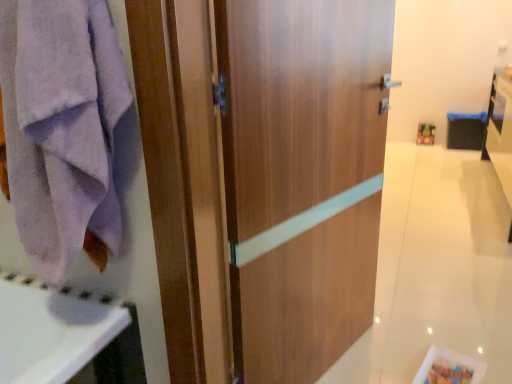
Identify the location of white glossy vanity at right. This screenshot has height=384, width=512. (500, 129).

Locate an element on the screen. The image size is (512, 384). wooden door at center is located at coordinates (266, 180).

The height and width of the screenshot is (384, 512). Identify the location of lavender cotton towel at left. (61, 125).

Find the location of a particular element. white glossy vanity at right is located at coordinates (500, 129).

Considering the sizes of white glossy vanity at right and wooden door at center in the image, is white glossy vanity at right wider or thinner than wooden door at center?

Clearly, white glossy vanity at right has more width compared to wooden door at center.

Is white glossy vanity at right looking in the opposite direction of wooden door at center?

white glossy vanity at right is not turned away from wooden door at center.

How distant is white glossy vanity at right from wooden door at center?

white glossy vanity at right is 9.16 feet from wooden door at center.

Who is bigger, white glossy vanity at right or wooden door at center?

white glossy vanity at right is bigger.

Is lavender cotton towel at left facing away from wooden door at center?

No, lavender cotton towel at left is not facing the opposite direction of wooden door at center.

How different are the orientations of lavender cotton towel at left and wooden door at center in degrees?

The angular difference between lavender cotton towel at left and wooden door at center is 0.000144 degrees.

In terms of width, does lavender cotton towel at left look wider or thinner when compared to wooden door at center?

Considering their sizes, lavender cotton towel at left looks broader than wooden door at center.

From the image's perspective, which object appears higher, lavender cotton towel at left or wooden door at center?

lavender cotton towel at left appears higher in the image.

Are wooden door at center and white glossy vanity at right making contact?

They are not placed beside each other.

Is the depth of wooden door at center less than that of white glossy vanity at right?

Yes.

Who is bigger, wooden door at center or white glossy vanity at right?

white glossy vanity at right.

Does point (325, 118) come behind point (508, 183)?

That is False.

From the image's perspective, does white glossy vanity at right appear lower than lavender cotton towel at left?

Actually, white glossy vanity at right appears above lavender cotton towel at left in the image.

Which is correct: white glossy vanity at right is inside lavender cotton towel at left, or outside of it?

white glossy vanity at right lies outside lavender cotton towel at left.

Considering the sizes of white glossy vanity at right and lavender cotton towel at left in the image, is white glossy vanity at right bigger or smaller than lavender cotton towel at left?

Clearly, white glossy vanity at right is larger in size than lavender cotton towel at left.

Which object is thinner, white glossy vanity at right or lavender cotton towel at left?

lavender cotton towel at left is thinner.

Could you tell me if lavender cotton towel at left is facing white glossy vanity at right?

No.

Is point (98, 10) closer to viewer compared to point (498, 83)?

Yes, it is in front of point (498, 83).

Does lavender cotton towel at left have a lesser height compared to white glossy vanity at right?

Correct, lavender cotton towel at left is not as tall as white glossy vanity at right.

Does lavender cotton towel at left come behind white glossy vanity at right?

No, lavender cotton towel at left is in front of white glossy vanity at right.

Does point (308, 193) lie in front of point (24, 54)?

No.

Where is `door that appears on the right of lavender cotton towel at left`? This screenshot has height=384, width=512. door that appears on the right of lavender cotton towel at left is located at coordinates (266, 180).

Are wooden door at center and lavender cotton towel at left making contact?

No, wooden door at center is not beside lavender cotton towel at left.

Is wooden door at center taller or shorter than lavender cotton towel at left?

In the image, wooden door at center appears to be taller than lavender cotton towel at left.

Where is `vanity below the wooden door at center (from a real-world perspective)`? This screenshot has width=512, height=384. vanity below the wooden door at center (from a real-world perspective) is located at coordinates (x=500, y=129).

I want to click on towel/napkin that is behind the wooden door at center, so click(x=61, y=125).

Which object lies nearer to the anchor point wooden door at center, lavender cotton towel at left or white glossy vanity at right?

lavender cotton towel at left lies closer to wooden door at center than the other object.

From the image, which object appears to be farther from lavender cotton towel at left, white glossy vanity at right or wooden door at center?

white glossy vanity at right.

Consider the image. Based on their spatial positions, is white glossy vanity at right or lavender cotton towel at left further from wooden door at center?

white glossy vanity at right.

From the image, which object appears to be nearer to white glossy vanity at right, lavender cotton towel at left or wooden door at center?

Among the two, wooden door at center is located nearer to white glossy vanity at right.

Looking at the image, which one is located further to lavender cotton towel at left, wooden door at center or white glossy vanity at right?

white glossy vanity at right.

Consider the image. From the image, which object appears to be nearer to white glossy vanity at right, wooden door at center or lavender cotton towel at left?

wooden door at center lies closer to white glossy vanity at right than the other object.

Find the location of a particular element. The width and height of the screenshot is (512, 384). door located between lavender cotton towel at left and white glossy vanity at right in the left-right direction is located at coordinates (266, 180).